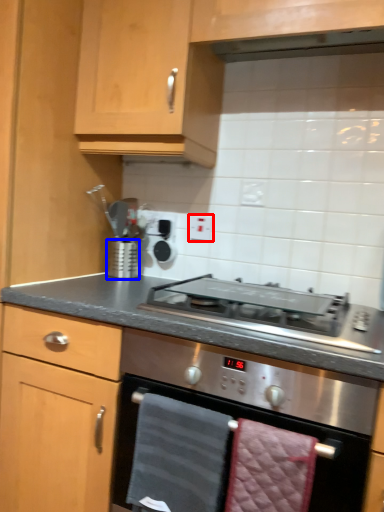
Question: Which object is closer to the camera taking this photo, electric outlet (highlighted by a red box) or kitchen appliance (highlighted by a blue box)?

Choices:
 (A) electric outlet
 (B) kitchen appliance

Answer: (B)